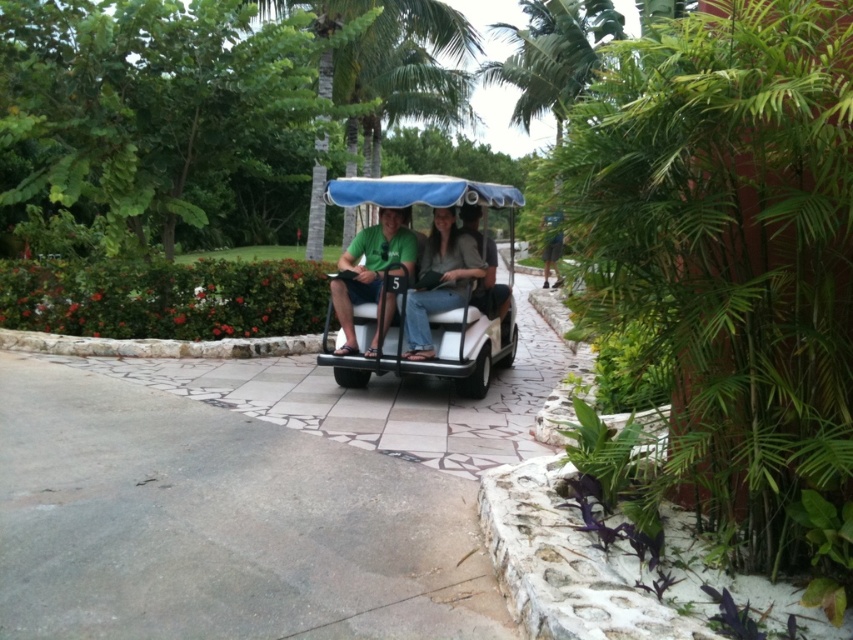
You are a maintenance worker at the resort and need to move a large equipment box that is the same size as the white matte golf cart at center. Can you store this box in the storage area where the green matte shirt at center is currently located?

The white matte golf cart at center is bigger than the green matte shirt at center. Since the equipment box is as big as the golf cart, it would not fit in the storage area where the green matte shirt at center is located because the shirt is smaller.

You are a guest at this resort and want to find the golf cart with the number 5. You see a point marked at coordinates [370,268]. What object is located at that point?

The point at coordinates [370,268] indicates the green matte shirt at center.

You are standing on the pathway and want to take a photo of the white matte golf cart at center and the green matte shirt at center. Which object will appear larger in your photo?

The white matte golf cart at center will appear larger in the photo because it is closer to the viewer than the green matte shirt at center.